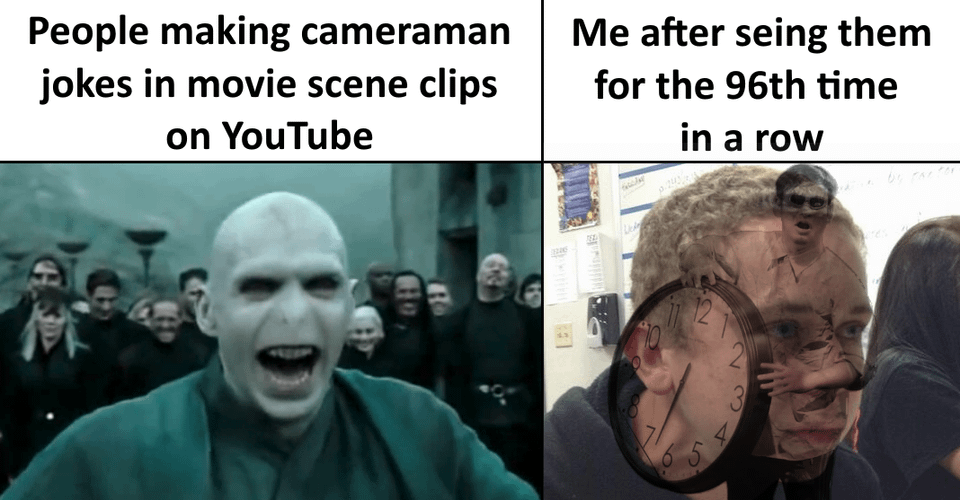
At what (x,y) coordinates should I click in order to perform the action: click on sanitizer dispencer. Please return your answer as a coordinate pair (x, y). This screenshot has width=960, height=500. Looking at the image, I should click on [604, 325].